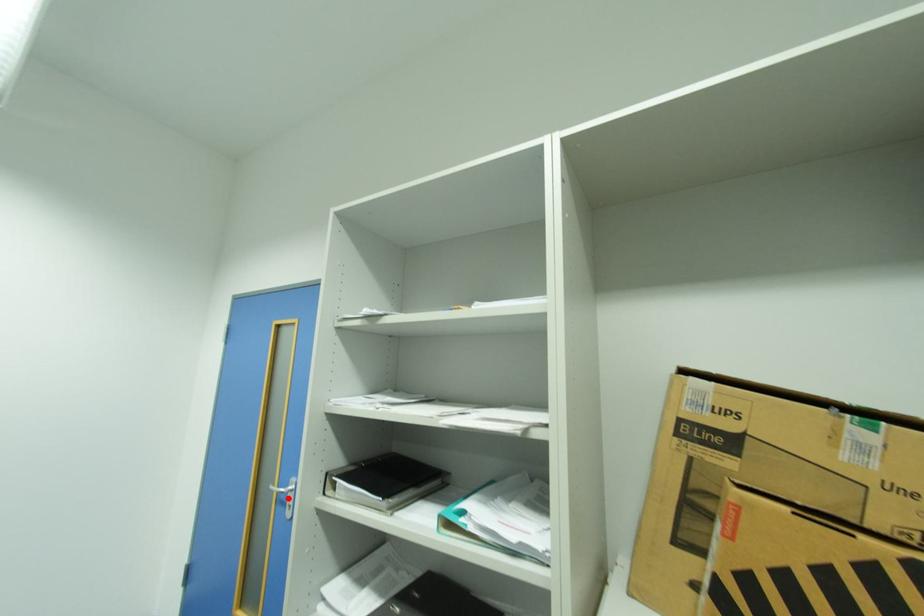
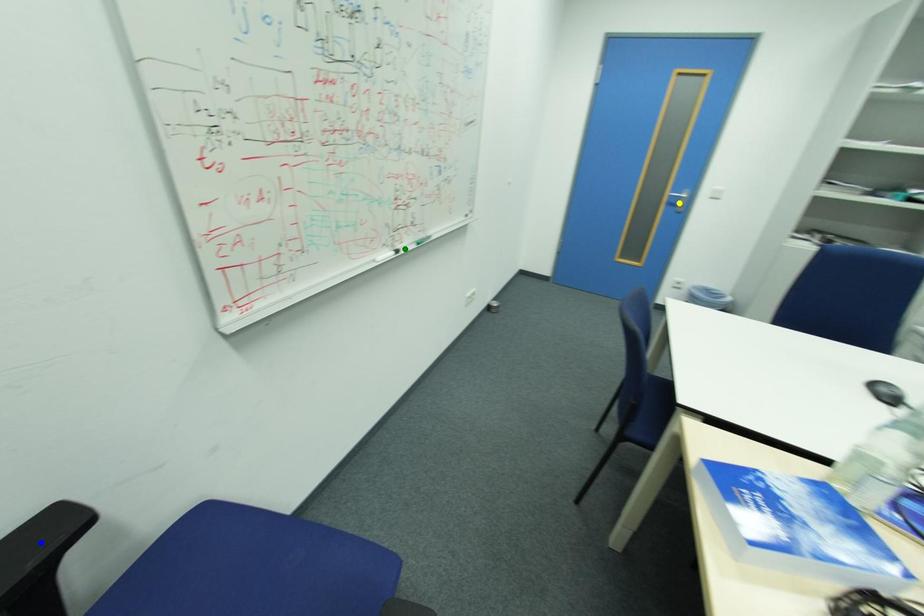
Question: I am providing you with two images of the same scene from different viewpoints. A red point is marked on the first image. You are given multiple points on the second image. In image 2, which mark is for the same physical point as the one in image 1?

Choices:
 (A) yellow point
 (B) green point
 (C) blue point

Answer: (A)